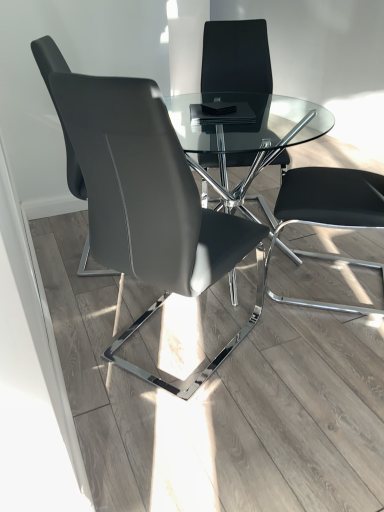
Question: Is black leather chair at right not close to matte black chair at center, positioned as the third chair in back-to-front order?

Choices:
 (A) yes
 (B) no

Answer: (B)

Question: From the image's perspective, is black leather chair at right below matte black chair at center, placed as the first chair when sorted from front to back?

Choices:
 (A) no
 (B) yes

Answer: (A)

Question: Does black leather chair at right have a lesser width compared to matte black chair at center, placed as the first chair when sorted from front to back?

Choices:
 (A) no
 (B) yes

Answer: (B)

Question: From a real-world perspective, is black leather chair at right located beneath matte black chair at center, placed as the first chair when sorted from front to back?

Choices:
 (A) yes
 (B) no

Answer: (B)

Question: From a real-world perspective, is black leather chair at right on top of matte black chair at center, positioned as the third chair in back-to-front order?

Choices:
 (A) no
 (B) yes

Answer: (B)

Question: Is black leather chair at right positioned before matte black chair at center, placed as the first chair when sorted from front to back?

Choices:
 (A) yes
 (B) no

Answer: (B)

Question: Is matte black chair at center, placed as the first chair when sorted from front to back, positioned far away from black leather chair at right?

Choices:
 (A) yes
 (B) no

Answer: (B)

Question: Would you say black leather chair at right is part of matte black chair at center, placed as the first chair when sorted from front to back,'s contents?

Choices:
 (A) no
 (B) yes

Answer: (A)

Question: Is matte black chair at center, placed as the first chair when sorted from front to back, smaller than black leather chair at right?

Choices:
 (A) no
 (B) yes

Answer: (A)

Question: Is matte black chair at center, placed as the first chair when sorted from front to back, at the left side of black leather chair at right?

Choices:
 (A) yes
 (B) no

Answer: (A)

Question: Is matte black chair at center, placed as the first chair when sorted from front to back, closer to the viewer compared to black leather chair at right?

Choices:
 (A) no
 (B) yes

Answer: (B)

Question: From the image's perspective, is matte black chair at center, positioned as the third chair in back-to-front order, beneath black leather chair at right?

Choices:
 (A) yes
 (B) no

Answer: (A)

Question: From the image's perspective, is matte black chair at left, the 2th chair viewed from the front, below black leather chair at right?

Choices:
 (A) yes
 (B) no

Answer: (B)